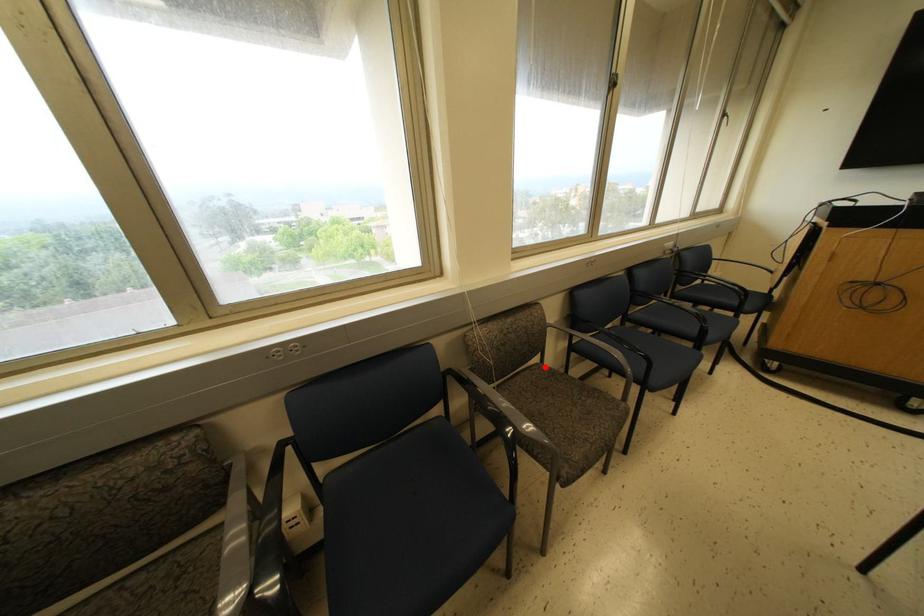
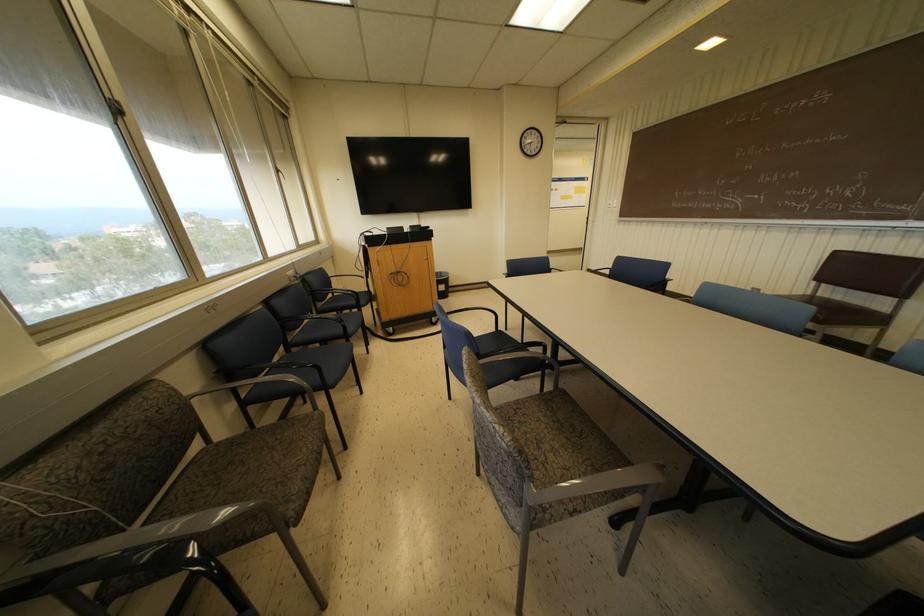
Question: I am providing you with two images of the same scene from different viewpoints. In image1, a red point is highlighted. Considering the same 3D point in image2, which of the following is correct?

Choices:
 (A) It is closer
 (B) It is farther

Answer: (A)